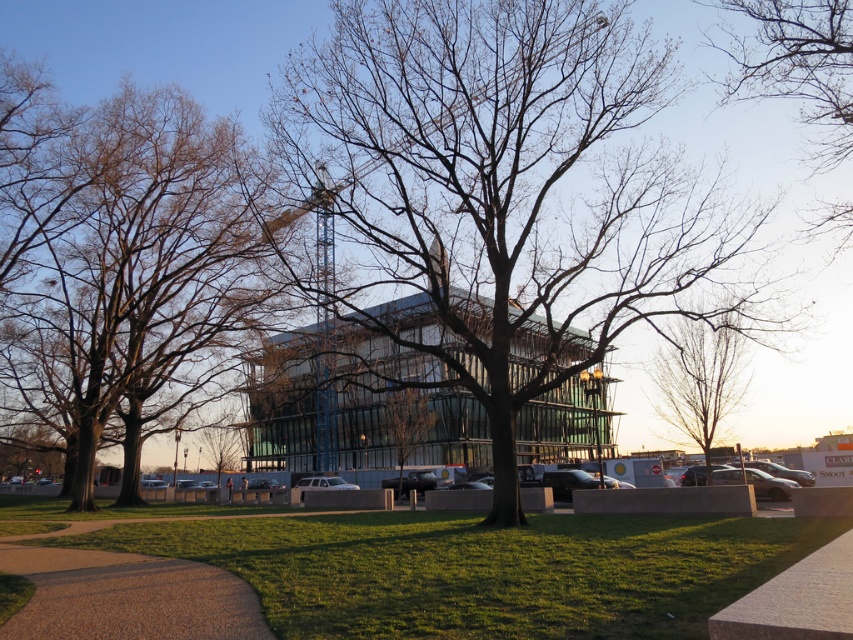
Is point (753, 90) behind point (723, 348)?

No.

The height and width of the screenshot is (640, 853). Find the location of `bare branches at upper right`. bare branches at upper right is located at coordinates click(796, 65).

Does point (51, 538) lie in front of point (741, 333)?

Yes, it is.

Between green grass at lower center and bare wood tree at right, which one appears on the right side from the viewer's perspective?

From the viewer's perspective, bare wood tree at right appears more on the right side.

Describe the element at coordinates (483, 570) in the screenshot. I see `green grass at lower center` at that location.

Find the location of a particular element. The image size is (853, 640). green grass at lower center is located at coordinates (483, 570).

Which of these two, brown smooth tree at center or green grass at lower center, stands taller?

With more height is brown smooth tree at center.

Does point (96, 118) come closer to viewer compared to point (543, 540)?

No, it is not.

Is point (144, 381) positioned after point (286, 595)?

Yes, point (144, 381) is behind point (286, 595).

Where is `brown smooth tree at center`? This screenshot has width=853, height=640. brown smooth tree at center is located at coordinates (131, 282).